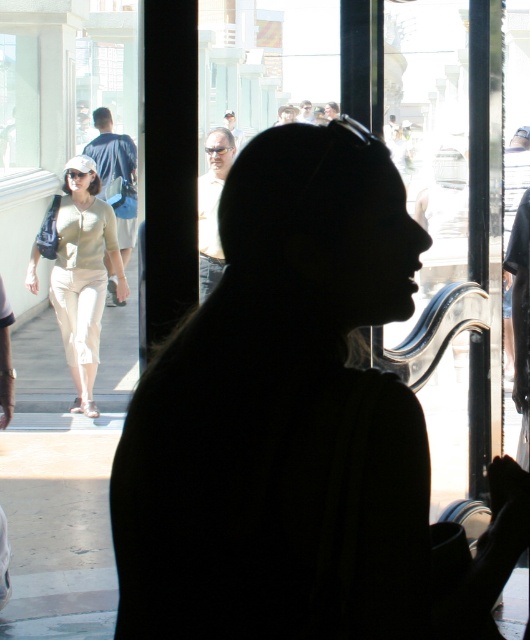
Question: Can you confirm if blue denim jacket at left is positioned above matte beige shirt at center?

Choices:
 (A) no
 (B) yes

Answer: (B)

Question: Can you confirm if beige cotton pants at left is positioned to the right of smooth black shirt at center?

Choices:
 (A) no
 (B) yes

Answer: (A)

Question: Which of the following is the closest to the observer?

Choices:
 (A) matte beige shirt at center
 (B) smooth black shirt at center
 (C) blue denim jacket at left
 (D) beige cotton pants at left

Answer: (B)

Question: Which point is farther to the camera?

Choices:
 (A) smooth black shirt at center
 (B) blue denim jacket at left
 (C) beige cotton pants at left
 (D) black matte hat at center

Answer: (B)

Question: Which point appears closest to the camera in this image?

Choices:
 (A) (304, 236)
 (B) (207, 211)

Answer: (A)

Question: Does smooth black shirt at center appear on the right side of blue denim jacket at left?

Choices:
 (A) yes
 (B) no

Answer: (A)